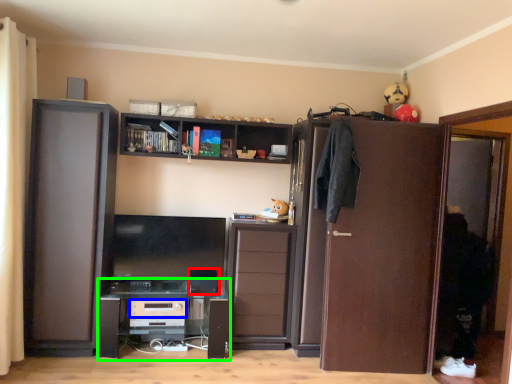
Question: Which object is positioned farthest from appliance (highlighted by a red box)? Select from appliance (highlighted by a blue box) and computer desk (highlighted by a green box).

Choices:
 (A) appliance
 (B) computer desk

Answer: (B)